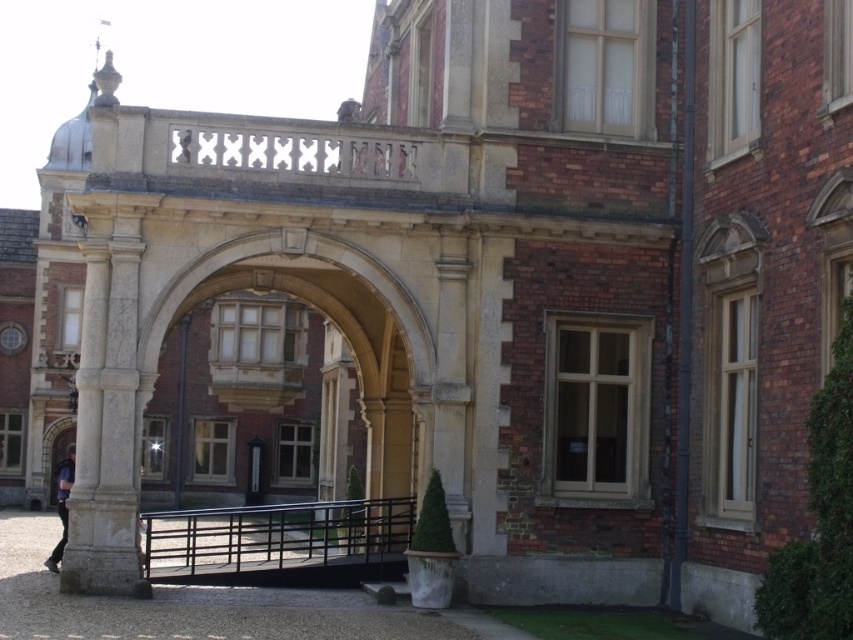
Can you confirm if black metal/rail at center is bigger than blue fabric shirt at lower left?

Yes.

Which is behind, point (218, 520) or point (70, 442)?

Point (70, 442)

Between point (154, 552) and point (57, 568), which one is positioned in front?

Positioned in front is point (154, 552).

This screenshot has width=853, height=640. Identify the location of black metal/rail at center. (277, 540).

Is smooth stone archway at center taller than blue fabric shirt at lower left?

Correct, smooth stone archway at center is much taller as blue fabric shirt at lower left.

Does smooth stone archway at center have a smaller size compared to blue fabric shirt at lower left?

Actually, smooth stone archway at center might be larger than blue fabric shirt at lower left.

Between point (286, 339) and point (57, 561), which one is positioned behind?

The point (286, 339) is more distant.

The image size is (853, 640). Find the location of `smooth stone archway at center`. smooth stone archway at center is located at coordinates (259, 449).

Looking at this image, can you confirm if white marble column at left is positioned to the right of blue fabric shirt at lower left?

Yes, white marble column at left is to the right of blue fabric shirt at lower left.

Measure the distance between white marble column at left and blue fabric shirt at lower left.

white marble column at left is 14.33 meters from blue fabric shirt at lower left.

Does point (134, 227) come closer to viewer compared to point (55, 561)?

Yes, point (134, 227) is in front of point (55, 561).

At what (x,y) coordinates should I click in order to perform the action: click on white marble column at left. Please return your answer as a coordinate pair (x, y). The image size is (853, 640). Looking at the image, I should click on (108, 404).